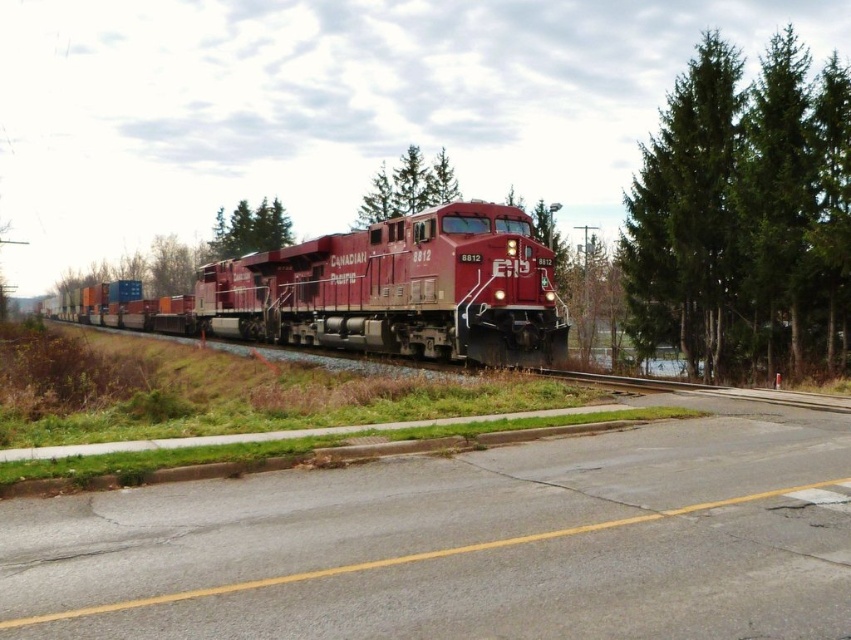
Question: Can you confirm if green textured tree at right is thinner than green textured tree at center?

Choices:
 (A) no
 (B) yes

Answer: (A)

Question: Which object appears farthest from the camera in this image?

Choices:
 (A) green matte tree at upper left
 (B) green textured tree at center

Answer: (A)

Question: Can you confirm if green textured tree at right is thinner than matte red locomotive at center?

Choices:
 (A) yes
 (B) no

Answer: (A)

Question: Which point is closer to the camera taking this photo?

Choices:
 (A) (684, 100)
 (B) (443, 150)
 (C) (328, 330)
 (D) (227, 225)

Answer: (A)

Question: Observing the image, what is the correct spatial positioning of matte red locomotive at center in reference to green textured tree at center?

Choices:
 (A) right
 (B) left

Answer: (B)

Question: Among these objects, which one is nearest to the camera?

Choices:
 (A) green textured tree at center
 (B) green textured tree at right
 (C) green matte tree at upper left

Answer: (B)